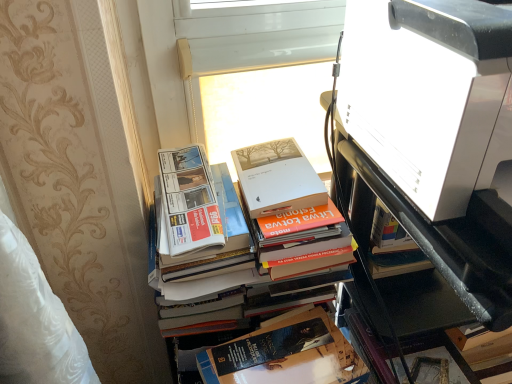
Question: Is white glossy printer at upper right positioned with its back to white plastic window screen at upper center?

Choices:
 (A) yes
 (B) no

Answer: (A)

Question: Considering the relative sizes of white glossy printer at upper right and white plastic window screen at upper center in the image provided, is white glossy printer at upper right taller than white plastic window screen at upper center?

Choices:
 (A) yes
 (B) no

Answer: (A)

Question: Is white glossy printer at upper right behind white plastic window screen at upper center?

Choices:
 (A) no
 (B) yes

Answer: (A)

Question: Are white glossy printer at upper right and white plastic window screen at upper center located far from each other?

Choices:
 (A) yes
 (B) no

Answer: (B)

Question: Considering the relative positions of white glossy printer at upper right and white plastic window screen at upper center in the image provided, is white glossy printer at upper right to the left of white plastic window screen at upper center from the viewer's perspective?

Choices:
 (A) no
 (B) yes

Answer: (A)

Question: Is white glossy printer at upper right wider than white plastic window screen at upper center?

Choices:
 (A) yes
 (B) no

Answer: (A)

Question: Is hardcover book at center surrounding white plastic window screen at upper center?

Choices:
 (A) no
 (B) yes

Answer: (A)

Question: From a real-world perspective, is hardcover book at center beneath white plastic window screen at upper center?

Choices:
 (A) no
 (B) yes

Answer: (B)

Question: Is hardcover book at center bigger than white plastic window screen at upper center?

Choices:
 (A) yes
 (B) no

Answer: (A)

Question: Is hardcover book at center at the right side of white plastic window screen at upper center?

Choices:
 (A) yes
 (B) no

Answer: (B)

Question: Is hardcover book at center positioned with its back to white plastic window screen at upper center?

Choices:
 (A) yes
 (B) no

Answer: (B)

Question: Is hardcover book at center touching white plastic window screen at upper center?

Choices:
 (A) no
 (B) yes

Answer: (A)

Question: Does white glossy printer at upper right have a greater height compared to white glossy printer at upper right?

Choices:
 (A) yes
 (B) no

Answer: (A)